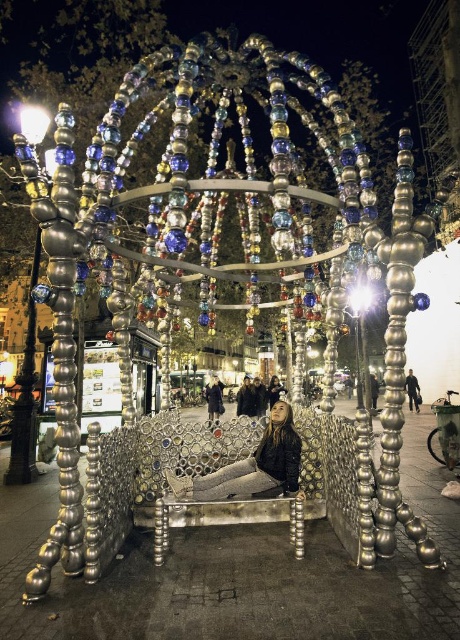
You are a photographer standing at the base of the art installation. You want to capture both the dark brown leather jacket at center and the dark gray jacket at lower right in the same frame. Given that your camera has a maximum focal length of 5 meters, can you include both jackets in a single photo without moving closer or farther away?

The distance between the dark brown leather jacket at center and the dark gray jacket at lower right is 5.34 meters. Since the camera can only focus up to 5 meters, the jackets are slightly out of range. To capture both, you would need to move closer to reduce the distance between them within the camera range.

You are an event organizer who needs to decide which jacket to use for the event photos. The dark brown leather jacket at center is smaller than the dark gray jacket at lower right. Which jacket would be more suitable for a model with a larger frame?

The dark gray jacket at lower right would be more suitable for a model with a larger frame since it has a bigger size compared to the dark brown leather jacket at center.